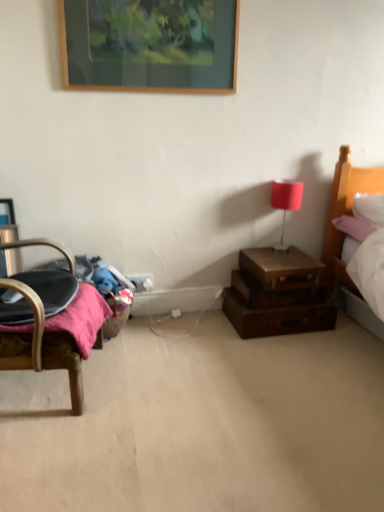
Locate an element on the screen. white plastic electric outlet at lower center is located at coordinates (141, 281).

Measure the distance between point (321, 291) and camera.

Point (321, 291) is 7.84 feet from camera.

What do you see at coordinates (286, 201) in the screenshot? The image size is (384, 512). I see `matte red table lamp at upper right` at bounding box center [286, 201].

This screenshot has height=512, width=384. What do you see at coordinates (149, 44) in the screenshot?
I see `wooden picture frame at upper center` at bounding box center [149, 44].

The width and height of the screenshot is (384, 512). Find the location of `white plastic electric outlet at lower center`. white plastic electric outlet at lower center is located at coordinates (141, 281).

Is brown wooden drawers at lower right taller or shorter than white plastic electric outlet at lower center?

Clearly, brown wooden drawers at lower right is taller compared to white plastic electric outlet at lower center.

Considering the relative positions of brown wooden drawers at lower right and white plastic electric outlet at lower center in the image provided, is brown wooden drawers at lower right to the left or to the right of white plastic electric outlet at lower center?

brown wooden drawers at lower right is positioned on white plastic electric outlet at lower center's right side.

Which is correct: brown wooden drawers at lower right is inside white plastic electric outlet at lower center, or outside of it?

brown wooden drawers at lower right is not enclosed by white plastic electric outlet at lower center.

Where is `drawer located underneath the wooden picture frame at upper center (from a real-world perspective)`? The image size is (384, 512). drawer located underneath the wooden picture frame at upper center (from a real-world perspective) is located at coordinates (278, 291).

Can wooden picture frame at upper center be found inside brown leather suitcase at lower right?

No, wooden picture frame at upper center is located outside of brown leather suitcase at lower right.

From the picture: Is brown leather suitcase at lower right taller than wooden picture frame at upper center?

Incorrect, the height of brown leather suitcase at lower right is not larger of that of wooden picture frame at upper center.

Can you tell me how much brown leather suitcase at lower right and wooden picture frame at upper center differ in facing direction?

They differ by 1.37 degrees in their facing directions.

Which is in front, matte red table lamp at upper right or brown leather suitcase at lower right?

brown leather suitcase at lower right.

Are matte red table lamp at upper right and brown leather suitcase at lower right located far from each other?

They are positioned close to each other.

From the image's perspective, is matte red table lamp at upper right positioned above or below brown leather suitcase at lower right?

Clearly, from the image's perspective, matte red table lamp at upper right is above brown leather suitcase at lower right.

Which of these two, matte red table lamp at upper right or brown leather suitcase at lower right, is wider?

brown leather suitcase at lower right.

Is white plastic electric outlet at lower center further to camera compared to brown leather suitcase at lower right?

Yes, the depth of white plastic electric outlet at lower center is greater than that of brown leather suitcase at lower right.

How many degrees apart are the facing directions of white plastic electric outlet at lower center and brown leather suitcase at lower right?

white plastic electric outlet at lower center and brown leather suitcase at lower right are facing 1.91 degrees away from each other.

Considering the positions of point (139, 277) and point (253, 296), is point (139, 277) closer or farther from the camera than point (253, 296)?

Point (139, 277) is positioned farther from the camera compared to point (253, 296).

In the image, is white plastic electric outlet at lower center on the left side or the right side of brown leather suitcase at lower right?

white plastic electric outlet at lower center is to the left of brown leather suitcase at lower right.

Considering the positions of points (292, 267) and (247, 279), is point (292, 267) closer to camera compared to point (247, 279)?

Yes, point (292, 267) is in front of point (247, 279).

Consider the image. Does brown leather suitcase at right have a greater height compared to brown leather suitcase at lower right?

Indeed, brown leather suitcase at right has a greater height compared to brown leather suitcase at lower right.

Locate an element on the screen. The height and width of the screenshot is (512, 384). drawer located below the brown leather suitcase at right (from the image's perspective) is located at coordinates (278, 291).

Between brown leather suitcase at right and brown leather suitcase at lower right, which one appears on the right side from the viewer's perspective?

From the viewer's perspective, brown leather suitcase at right appears more on the right side.

Considering the positions of objects brown leather suitcase at right and matte red table lamp at upper right in the image provided, who is behind, brown leather suitcase at right or matte red table lamp at upper right?

matte red table lamp at upper right is further from the camera.

Choose the correct answer: Is brown leather suitcase at right inside matte red table lamp at upper right or outside it?

brown leather suitcase at right is outside matte red table lamp at upper right.

From the image's perspective, is brown leather suitcase at right under matte red table lamp at upper right?

Yes, from the image's perspective, brown leather suitcase at right is below matte red table lamp at upper right.

Does brown leather suitcase at right touch matte red table lamp at upper right?

No.

From a real-world perspective, relative to brown leather suitcase at right, is white plastic electric outlet at lower center vertically above or below?

white plastic electric outlet at lower center is situated lower than brown leather suitcase at right in the real world.

Is white plastic electric outlet at lower center oriented away from brown leather suitcase at right?

white plastic electric outlet at lower center does not have its back to brown leather suitcase at right.

How different are the orientations of white plastic electric outlet at lower center and brown leather suitcase at right in degrees?

0.0076 degrees.

You are a GUI agent. You are given a task and a screenshot of the screen. Output one action in this format:
    pyautogui.click(x=<x>, y=<y>)
    Task: Click on the nightstand on the right of white plastic electric outlet at lower center
    The image size is (384, 512).
    Given the screenshot: What is the action you would take?
    pyautogui.click(x=278, y=294)

At what (x,y) coordinates should I click in order to perform the action: click on drawer behind the wooden picture frame at upper center. Please return your answer as a coordinate pair (x, y). The image size is (384, 512). Looking at the image, I should click on (278, 291).

Looking at the image, which one is located closer to wooden picture frame at upper center, brown wooden drawers at lower right or brown leather suitcase at right?

Based on the image, brown leather suitcase at right appears to be nearer to wooden picture frame at upper center.

From the picture: Which object lies nearer to the anchor point brown leather suitcase at lower right, matte red table lamp at upper right or white plastic electric outlet at lower center?

The object closer to brown leather suitcase at lower right is matte red table lamp at upper right.

Considering their positions, is white plastic electric outlet at lower center positioned further to matte red table lamp at upper right than brown leather suitcase at right?

white plastic electric outlet at lower center.

Considering their positions, is brown leather suitcase at lower right positioned further to wooden picture frame at upper center than brown wooden drawers at lower right?

brown leather suitcase at lower right.

Based on their spatial positions, is brown leather suitcase at lower right or brown wooden drawers at lower right further from brown leather suitcase at right?

brown wooden drawers at lower right lies further to brown leather suitcase at right than the other object.

Considering their positions, is brown leather suitcase at right positioned closer to brown wooden drawers at lower right than brown leather suitcase at lower right?

brown leather suitcase at lower right.

Which object lies further to the anchor point matte red table lamp at upper right, wooden picture frame at upper center or white plastic electric outlet at lower center?

The object further to matte red table lamp at upper right is wooden picture frame at upper center.

Considering their positions, is wooden picture frame at upper center positioned closer to brown leather suitcase at right than white plastic electric outlet at lower center?

white plastic electric outlet at lower center.

The width and height of the screenshot is (384, 512). I want to click on box between white plastic electric outlet at lower center and matte red table lamp at upper right, so click(282, 268).

What are the coordinates of `box between wooden picture frame at upper center and brown leather suitcase at lower right vertically` in the screenshot? It's located at (282, 268).

Image resolution: width=384 pixels, height=512 pixels. I want to click on drawer situated between white plastic electric outlet at lower center and brown leather suitcase at right from left to right, so click(x=278, y=291).

This screenshot has width=384, height=512. Find the location of `drawer between wooden picture frame at upper center and brown wooden drawers at lower right vertically`. drawer between wooden picture frame at upper center and brown wooden drawers at lower right vertically is located at coordinates (278, 291).